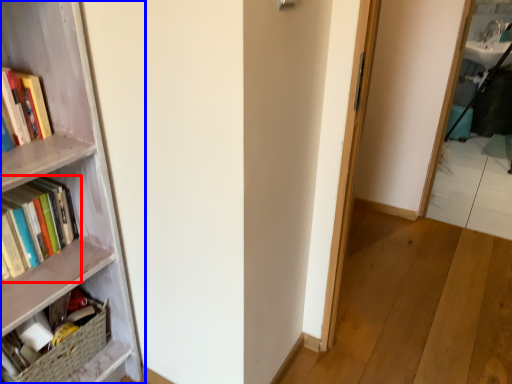
Question: Which object appears farthest to the camera in this image, book (highlighted by a red box) or bookcase (highlighted by a blue box)?

Choices:
 (A) book
 (B) bookcase

Answer: (A)